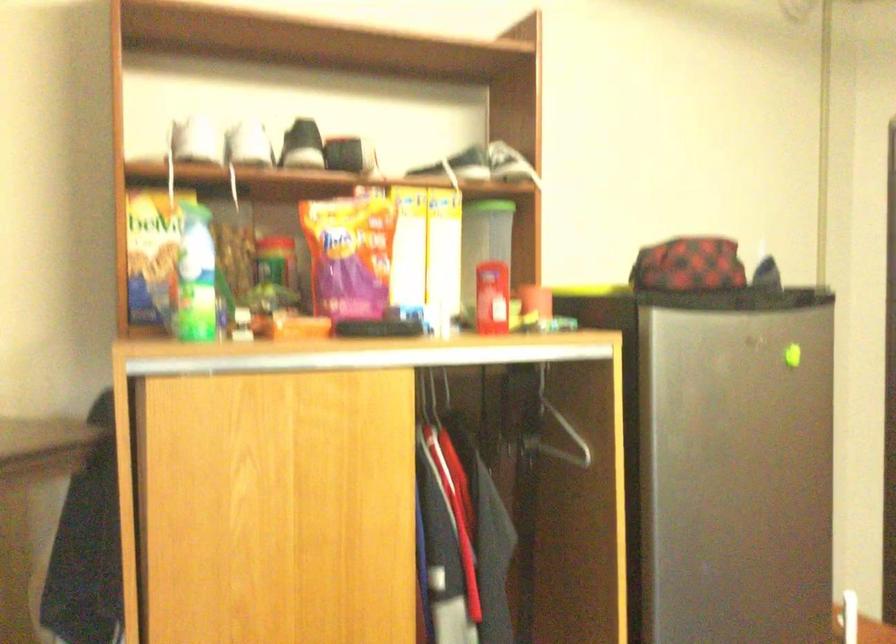
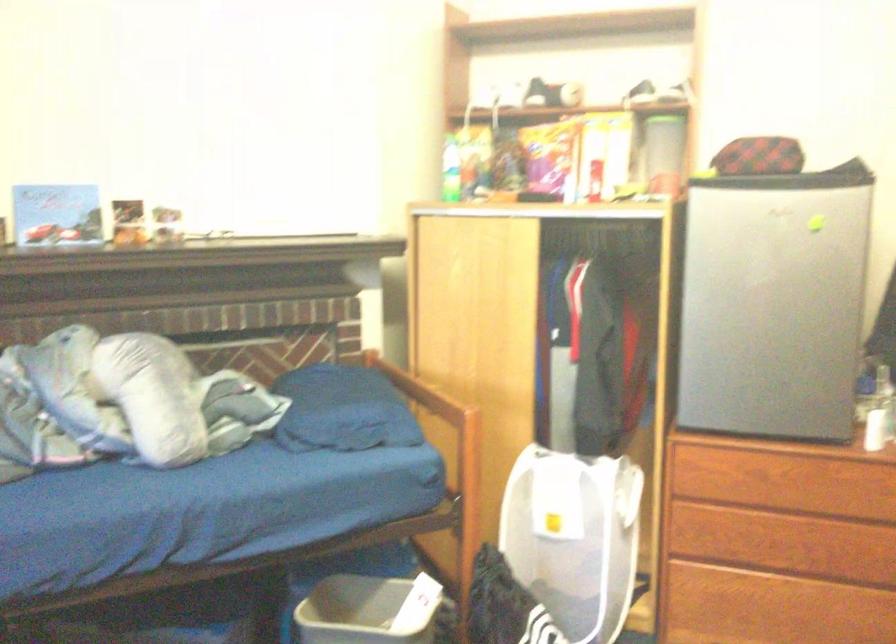
Find the pixel in the second image that matches (x=756, y=471) in the first image.

(771, 303)